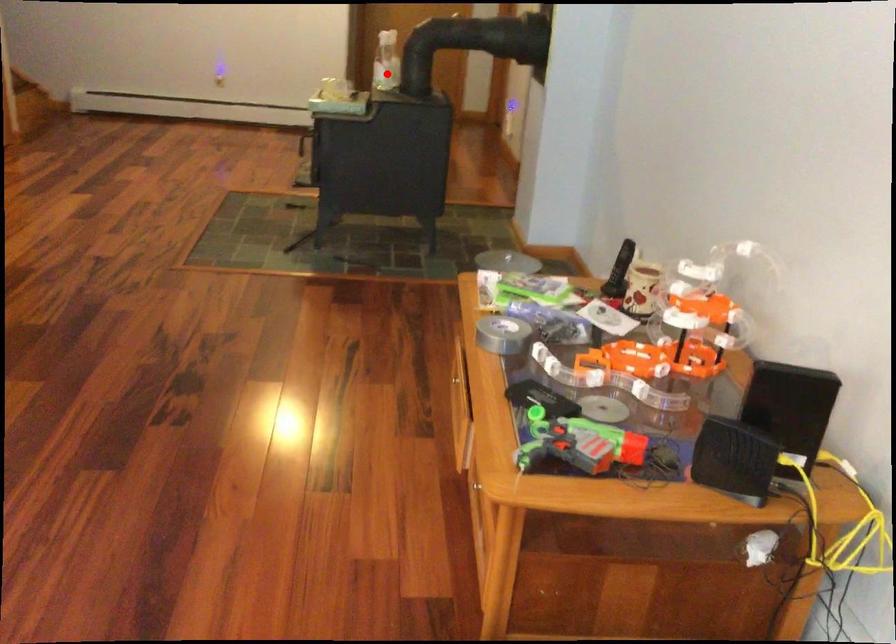
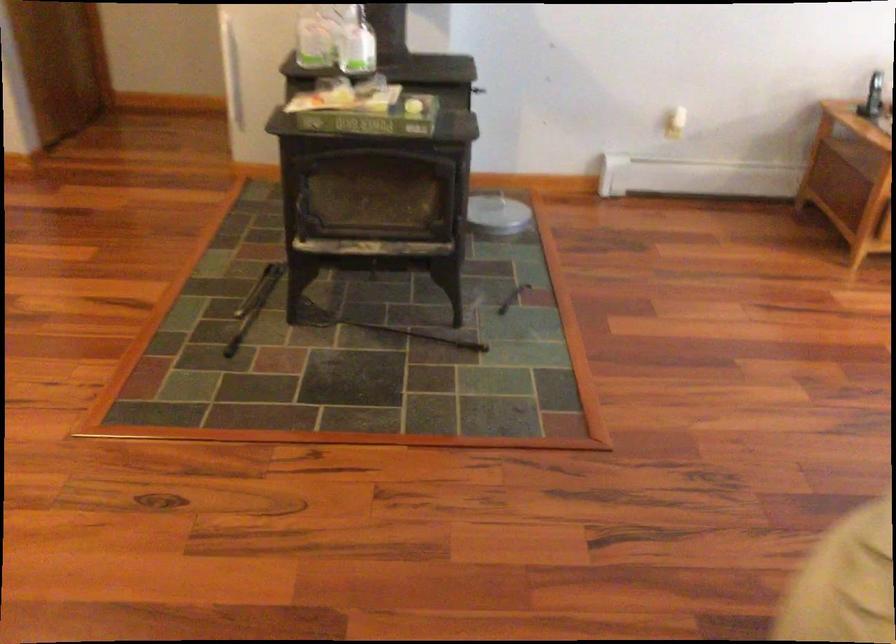
Where in the second image is the point corresponding to the highlighted location from the first image?

(314, 41)